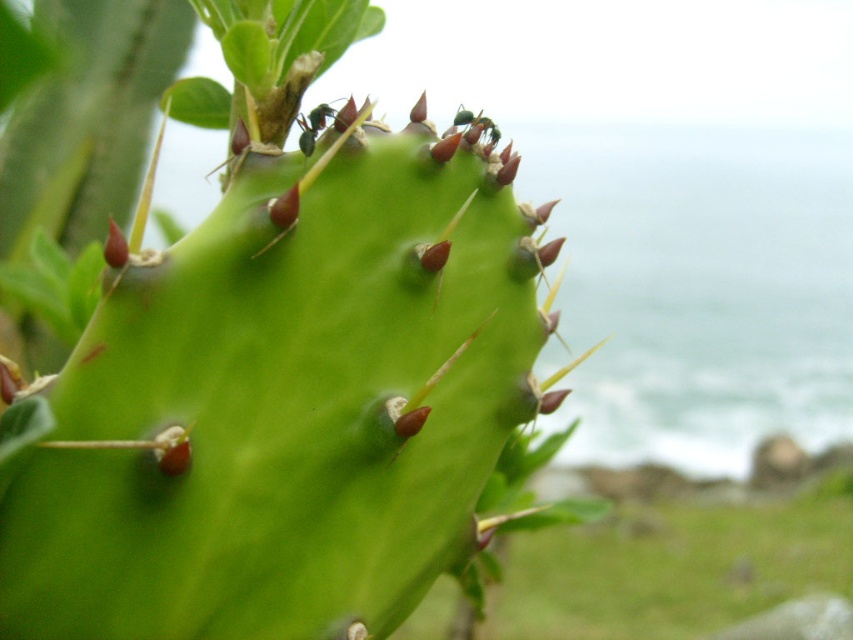
Question: Does green spiny cactus at center appear over black glossy ant at upper center?

Choices:
 (A) no
 (B) yes

Answer: (A)

Question: Does green spiny cactus at center come in front of black glossy ant at upper center?

Choices:
 (A) no
 (B) yes

Answer: (B)

Question: Which of the following is the farthest from the observer?

Choices:
 (A) (317, 125)
 (B) (523, 314)

Answer: (B)

Question: Which object is closer to the camera taking this photo?

Choices:
 (A) green spiny cactus at center
 (B) black glossy ant at upper center

Answer: (A)

Question: From the image, what is the correct spatial relationship of green spiny cactus at center in relation to black glossy ant at upper center?

Choices:
 (A) above
 (B) below

Answer: (B)